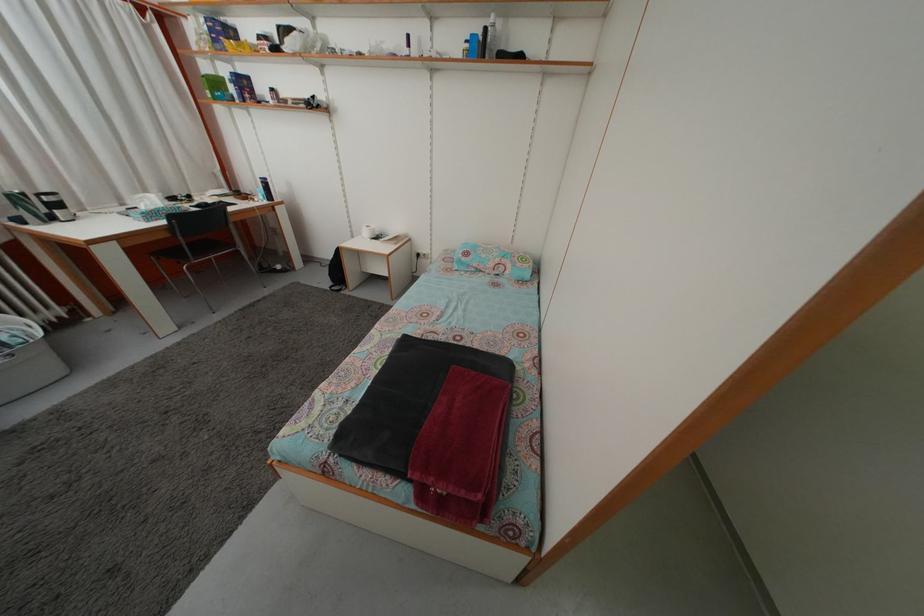
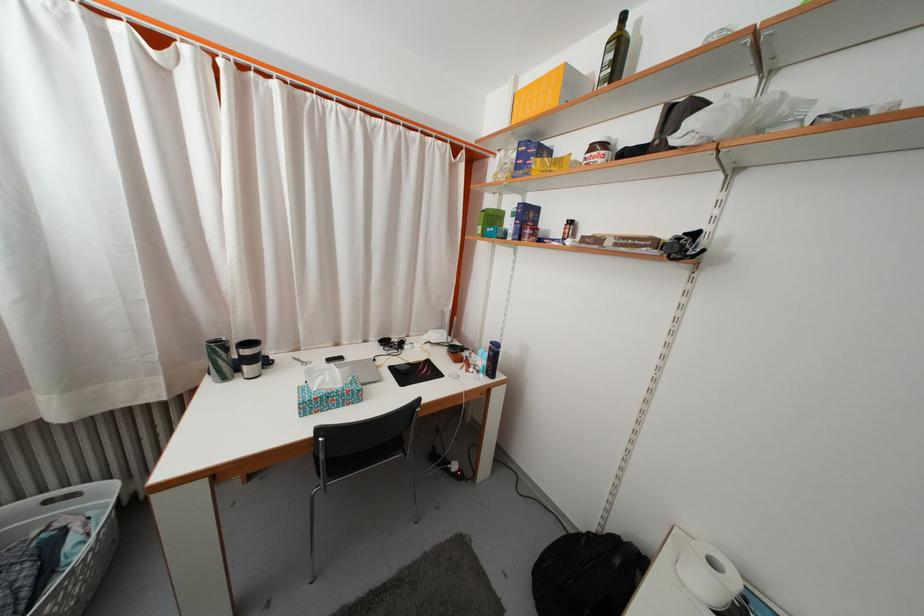
In the second image, find the point that corresponds to (x=220, y=47) in the first image.

(523, 175)